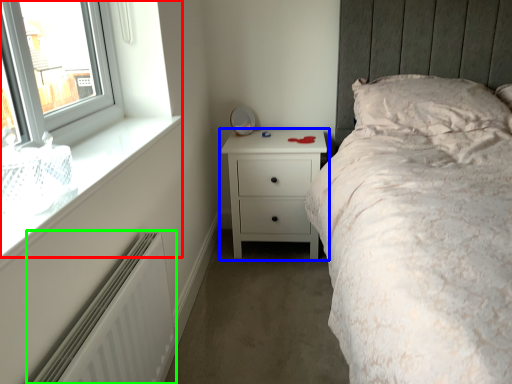
Question: Which object is positioned closest to window (highlighted by a red box)? Select from chest of drawers (highlighted by a blue box) and radiator (highlighted by a green box).

Choices:
 (A) chest of drawers
 (B) radiator

Answer: (B)